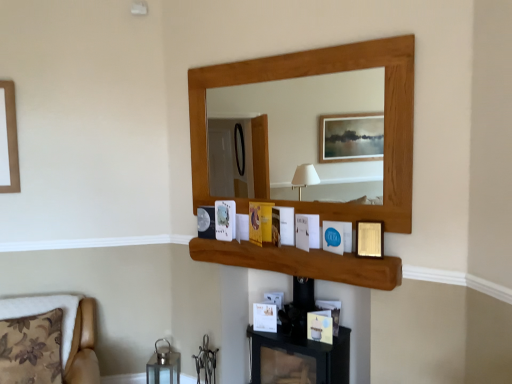
The image size is (512, 384). Describe the element at coordinates (370, 239) in the screenshot. I see `gold metallic picture frame at upper center, positioned as the second picture frame in bottom-to-top order` at that location.

What is the approximate height of metallic glass lantern at lower left?

It is 14.91 inches.

What do you see at coordinates (206, 222) in the screenshot?
I see `metallic silver picture frame at lower left, which is the fifth picture frame from right to left` at bounding box center [206, 222].

Describe the element at coordinates (225, 220) in the screenshot. Image resolution: width=512 pixels, height=384 pixels. I see `white paper at center, which appears as the fourth picture frame when viewed from the front` at that location.

Describe the element at coordinates (302, 262) in the screenshot. I see `wooden shelf at center` at that location.

This screenshot has height=384, width=512. I want to click on matte gold picture frame at center, which ranks as the fifth picture frame in top-to-bottom order, so click(320, 326).

Identify the location of gold metallic picture frame at upper center, arranged as the 1th picture frame when viewed from the right. This screenshot has width=512, height=384. (370, 239).

In terms of width, does floral fabric cushion at lower left look wider or thinner when compared to blue paper at center, placed as the fourth picture frame when sorted from back to front?

Considering their sizes, floral fabric cushion at lower left looks broader than blue paper at center, placed as the fourth picture frame when sorted from back to front.

From the image's perspective, is floral fabric cushion at lower left over blue paper at center, placed as the fourth picture frame when sorted from back to front?

No, from the image's perspective, floral fabric cushion at lower left is not above blue paper at center, placed as the fourth picture frame when sorted from back to front.

Between floral fabric cushion at lower left and blue paper at center, which is the fourth picture frame from left to right, which one is positioned in front?

floral fabric cushion at lower left is closer to the camera.

Considering their positions, is white paper at center, which appears as the fourth picture frame when viewed from the front, located in front of or behind wooden shelf at center?

In the image, white paper at center, which appears as the fourth picture frame when viewed from the front, appears behind wooden shelf at center.

Consider the image. Can you confirm if white paper at center, the 5th picture frame positioned from the bottom, is smaller than wooden shelf at center?

Yes, white paper at center, the 5th picture frame positioned from the bottom, is smaller than wooden shelf at center.

Is white paper at center, positioned as the 2th picture frame in left-to-right order, aimed at wooden shelf at center?

No.

The image size is (512, 384). I want to click on cabinet that appears in front of the white paper at center, which is counted as the second picture frame, starting from the back, so click(302, 262).

Is blue paper at center, which appears as the 3th picture frame when viewed from the top, not inside matte gold picture frame at center, positioned as the third picture frame in back-to-front order?

Yes, blue paper at center, which appears as the 3th picture frame when viewed from the top, is outside of matte gold picture frame at center, positioned as the third picture frame in back-to-front order.

Is blue paper at center, the second picture frame in the right-to-left sequence, next to matte gold picture frame at center, acting as the 3th picture frame starting from the front?

blue paper at center, the second picture frame in the right-to-left sequence, and matte gold picture frame at center, acting as the 3th picture frame starting from the front, are clearly separated.

Is blue paper at center, placed as the fourth picture frame when sorted from back to front, positioned before matte gold picture frame at center, positioned as the 1th picture frame in bottom-to-top order?

Yes, blue paper at center, placed as the fourth picture frame when sorted from back to front, is closer to the camera.

Is metallic glass lantern at lower left wider or thinner than white paper at center, the first picture frame positioned from the top?

metallic glass lantern at lower left is wider than white paper at center, the first picture frame positioned from the top.

Does metallic glass lantern at lower left contain white paper at center, which appears as the fourth picture frame when viewed from the front?

No, white paper at center, which appears as the fourth picture frame when viewed from the front, is not surrounded by metallic glass lantern at lower left.

From a real-world perspective, which object rests below the other?

metallic glass lantern at lower left, from a real-world perspective.

In the image, is metallic glass lantern at lower left on the left side or the right side of white paper at center, the first picture frame positioned from the top?

From the image, it's evident that metallic glass lantern at lower left is to the left of white paper at center, the first picture frame positioned from the top.

Is wooden shelf at center behind blue paper at center, the second picture frame in the right-to-left sequence?

No, wooden shelf at center is closer to the viewer.

Starting from the wooden shelf at center, which picture frame is the 2nd one behind? Please provide its 2D coordinates.

[(337, 237)]

From a real-world perspective, is wooden shelf at center positioned above or below blue paper at center, which is the fourth picture frame from left to right?

Clearly, from a real-world perspective, wooden shelf at center is below blue paper at center, which is the fourth picture frame from left to right.

Can you tell me how much wooden shelf at center and blue paper at center, placed as the fourth picture frame when sorted from back to front, differ in facing direction?

26.2 degrees.

Can you see white paper at center, which is counted as the second picture frame, starting from the back, touching floral fabric cushion at lower left?

They are not placed beside each other.

In the scene shown: Is white paper at center, the 5th picture frame positioned from the bottom, at the left side of floral fabric cushion at lower left?

Answer: No, white paper at center, the 5th picture frame positioned from the bottom, is not to the left of floral fabric cushion at lower left.

At what (x,y) coordinates should I click in order to perform the action: click on furniture located below the white paper at center, the 5th picture frame positioned from the bottom (from the image's perspective). Please return your answer as a coordinate pair (x, y). This screenshot has height=384, width=512. Looking at the image, I should click on (83, 342).

Considering the positions of point (232, 207) and point (78, 367), is point (232, 207) closer or farther from the camera than point (78, 367)?

Clearly, point (232, 207) is more distant from the camera than point (78, 367).

Is white paper at center, the first picture frame positioned from the top, positioned with its back to metallic glass lantern at lower left?

white paper at center, the first picture frame positioned from the top, does not have its back to metallic glass lantern at lower left.

Does point (221, 231) appear closer or farther from the camera than point (158, 357)?

Clearly, point (221, 231) is closer to the camera than point (158, 357).

Is white paper at center, which appears as the fourth picture frame when viewed from the front, located outside metallic glass lantern at lower left?

Yes.

From a real-world perspective, count 5th picture frames upward from the metallic glass lantern at lower left and point to it. Please provide its 2D coordinates.

[(225, 220)]

The width and height of the screenshot is (512, 384). I want to click on picture frame that is the 2nd object above the floral fabric cushion at lower left (from a real-world perspective), so click(337, 237).

You are a GUI agent. You are given a task and a screenshot of the screen. Output one action in this format:
    pyautogui.click(x=<x>, y=<y>)
    Task: Click on the cabinet on the right of white paper at center, which appears as the fourth picture frame when viewed from the front
    The image size is (512, 384).
    Given the screenshot: What is the action you would take?
    pyautogui.click(x=302, y=262)

Estimate the real-world distances between objects in this image. Which object is closer to wooden shelf at center, gold metallic picture frame at upper center, placed as the fifth picture frame when sorted from back to front, or metallic glass lantern at lower left?

Based on the image, gold metallic picture frame at upper center, placed as the fifth picture frame when sorted from back to front, appears to be nearer to wooden shelf at center.

When comparing their distances from metallic silver picture frame at lower left, acting as the first picture frame starting from the left, does white paper at center, the 5th picture frame positioned from the bottom, or blue paper at center, the second picture frame in the right-to-left sequence, seem further?

The object further to metallic silver picture frame at lower left, acting as the first picture frame starting from the left, is blue paper at center, the second picture frame in the right-to-left sequence.

Looking at the image, which one is located further to gold metallic picture frame at upper center, placed as the fifth picture frame when sorted from back to front, blue paper at center, which is counted as the 3th picture frame, starting from the bottom, or metallic silver picture frame at lower left, which ranks as the 5th picture frame in front-to-back order?

Among the two, metallic silver picture frame at lower left, which ranks as the 5th picture frame in front-to-back order, is located further to gold metallic picture frame at upper center, placed as the fifth picture frame when sorted from back to front.

Based on their spatial positions, is white paper at center, the first picture frame positioned from the top, or gold metallic picture frame at upper center, the 5th picture frame from the left, closer to metallic glass lantern at lower left?

white paper at center, the first picture frame positioned from the top, lies closer to metallic glass lantern at lower left than the other object.

Estimate the real-world distances between objects in this image. Which object is further from metallic glass lantern at lower left, gold metallic picture frame at upper center, placed as the fifth picture frame when sorted from back to front, or white paper at center, which is counted as the second picture frame, starting from the back?

Among the two, gold metallic picture frame at upper center, placed as the fifth picture frame when sorted from back to front, is located further to metallic glass lantern at lower left.

Which object lies further to the anchor point floral fabric cushion at lower left, metallic silver picture frame at lower left, which is counted as the 1th picture frame, starting from the back, or blue paper at center, which is the fourth picture frame from left to right?

The object further to floral fabric cushion at lower left is blue paper at center, which is the fourth picture frame from left to right.

Which object lies further to the anchor point wooden shelf at center, metallic silver picture frame at lower left, which ranks as the 5th picture frame in front-to-back order, or matte gold picture frame at center, the 3th picture frame in the right-to-left sequence?

matte gold picture frame at center, the 3th picture frame in the right-to-left sequence, lies further to wooden shelf at center than the other object.

Based on their spatial positions, is metallic silver picture frame at lower left, which ranks as the 2th picture frame in top-to-bottom order, or wooden shelf at center closer to metallic glass lantern at lower left?

metallic silver picture frame at lower left, which ranks as the 2th picture frame in top-to-bottom order.

Locate an element on the screen. The height and width of the screenshot is (384, 512). cabinet between white paper at center, the 5th picture frame positioned from the bottom, and blue paper at center, which is counted as the 3th picture frame, starting from the bottom is located at coordinates (302, 262).

Identify the location of cabinet between blue paper at center, the second picture frame in the right-to-left sequence, and matte gold picture frame at center, which ranks as the fifth picture frame in top-to-bottom order, vertically. (302, 262).

Find the location of `cabinet located between metallic glass lantern at lower left and matte gold picture frame at center, positioned as the third picture frame in back-to-front order, in the left-right direction`. cabinet located between metallic glass lantern at lower left and matte gold picture frame at center, positioned as the third picture frame in back-to-front order, in the left-right direction is located at coordinates (302, 262).

The image size is (512, 384). Identify the location of cabinet between metallic glass lantern at lower left and blue paper at center, which is the fourth picture frame from left to right, in the horizontal direction. (302, 262).